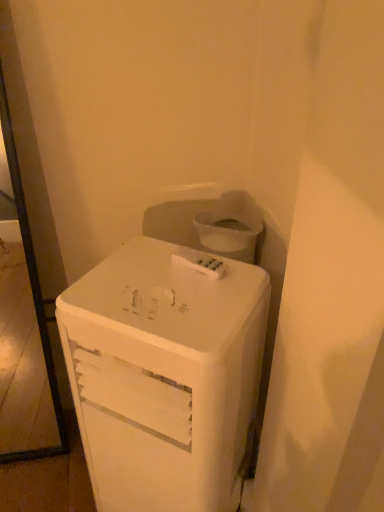
Image resolution: width=384 pixels, height=512 pixels. Describe the element at coordinates (165, 375) in the screenshot. I see `white matte refrigerator at center` at that location.

Where is `white matte refrigerator at center`? The image size is (384, 512). white matte refrigerator at center is located at coordinates (165, 375).

I want to click on white matte refrigerator at center, so click(x=165, y=375).